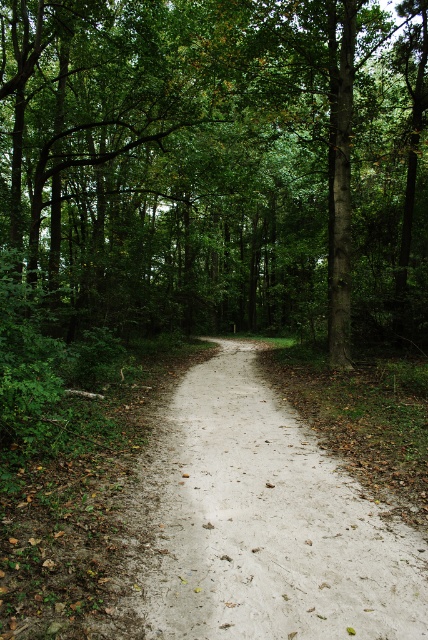
You are a hiker carrying a heavy backpack and want to walk along the sandy path at center. However, you notice the green leafy tree at center above you. Do you think the tree will block your path?

The green leafy tree at center is positioned over sandy path at center, so the tree will block your path.

You are a hiker walking along the sandy path at center in the forest. You notice a green leafy tree at center nearby. Which object is taller?

The green leafy tree at center is taller than the sandy path at center.

You are a hiker standing on the sandy path at center and looking towards the green leafy tree at center. Which object is closer to you?

The green leafy tree at center is closer to you because it is positioned further to the viewer than the sandy path at center, meaning it appears nearer in the scene.